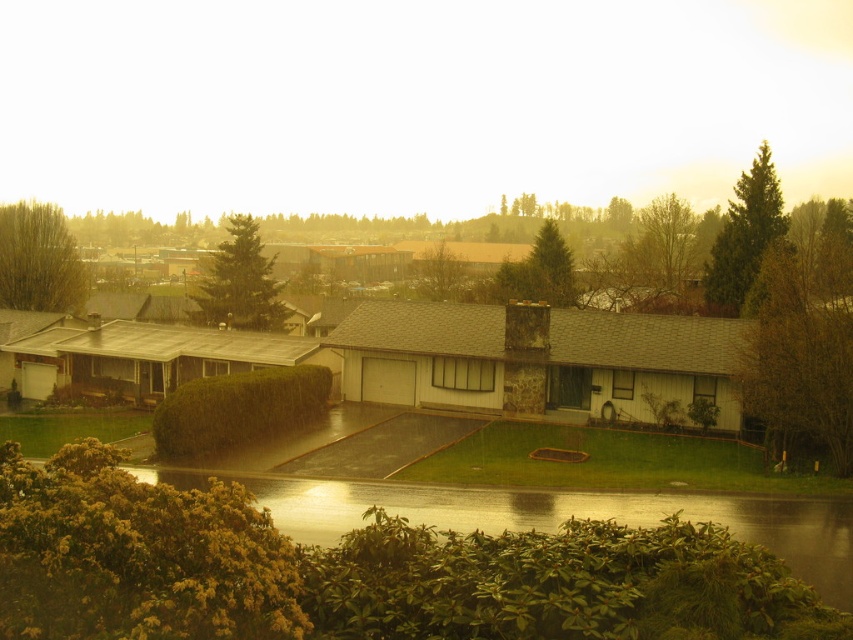
Can you confirm if green fuzzy bush at lower left is positioned to the left of green leafy tree at center?

Yes, green fuzzy bush at lower left is to the left of green leafy tree at center.

Who is more forward, (242,611) or (418,259)?

Point (242,611) is in front.

This screenshot has width=853, height=640. I want to click on green fuzzy bush at lower left, so click(136, 556).

The height and width of the screenshot is (640, 853). What do you see at coordinates (241, 282) in the screenshot? I see `green matte tree at center` at bounding box center [241, 282].

Is point (245, 234) positioned before point (540, 276)?

No, it is behind (540, 276).

Is point (219, 310) positioned behind point (570, 269)?

No.

You are a GUI agent. You are given a task and a screenshot of the screen. Output one action in this format:
    pyautogui.click(x=<x>, y=<y>)
    Task: Click on the green matte tree at center
    The width and height of the screenshot is (853, 640).
    Given the screenshot: What is the action you would take?
    pyautogui.click(x=241, y=282)

Between green textured tree at upper right and green matte tree at center, which one has more height?

Standing taller between the two is green matte tree at center.

Does green textured tree at upper right appear under green matte tree at center?

Yes.

You are a GUI agent. You are given a task and a screenshot of the screen. Output one action in this format:
    pyautogui.click(x=<x>, y=<y>)
    Task: Click on the green textured tree at upper right
    The height and width of the screenshot is (640, 853).
    Given the screenshot: What is the action you would take?
    pyautogui.click(x=744, y=236)